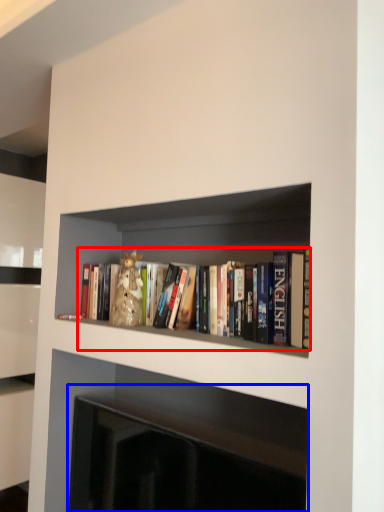
Question: Which of the following is the closest to the observer, book (highlighted by a red box) or fireplace (highlighted by a blue box)?

Choices:
 (A) book
 (B) fireplace

Answer: (B)